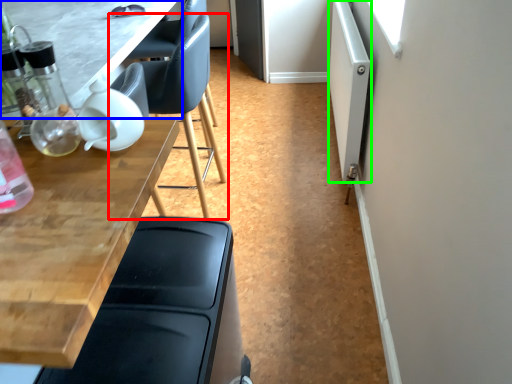
Question: Estimate the real-world distances between objects in this image. Which object is farther from chair (highlighted by a red box), table (highlighted by a blue box) or screen door (highlighted by a green box)?

Choices:
 (A) table
 (B) screen door

Answer: (B)